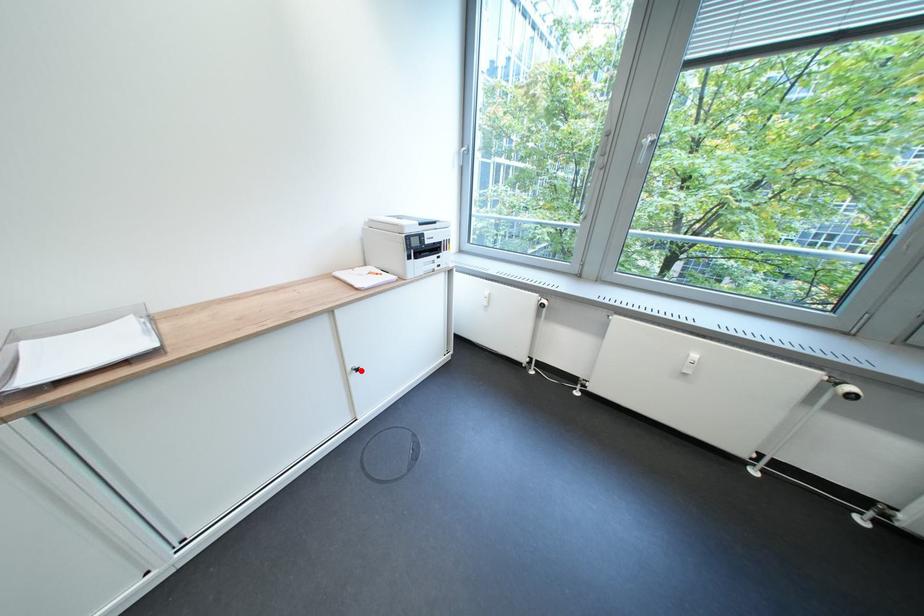
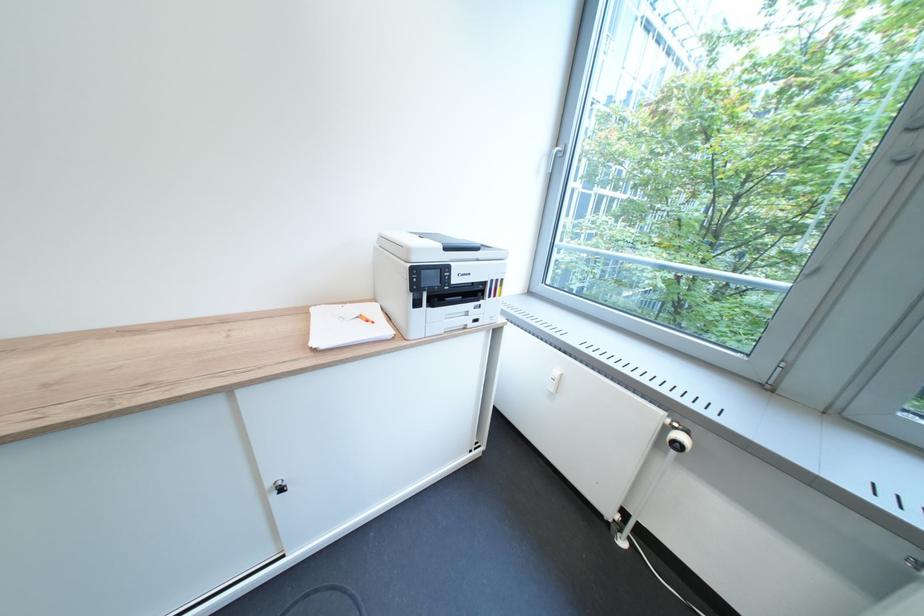
In the second image, find the point that corresponds to the highlighted location in the first image.

(282, 485)